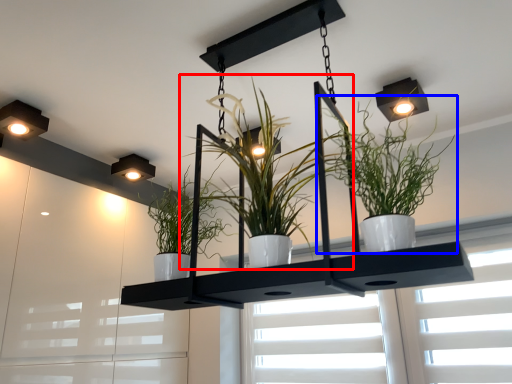
Question: Which object is closer to the camera taking this photo, houseplant (highlighted by a red box) or houseplant (highlighted by a blue box)?

Choices:
 (A) houseplant
 (B) houseplant

Answer: (B)